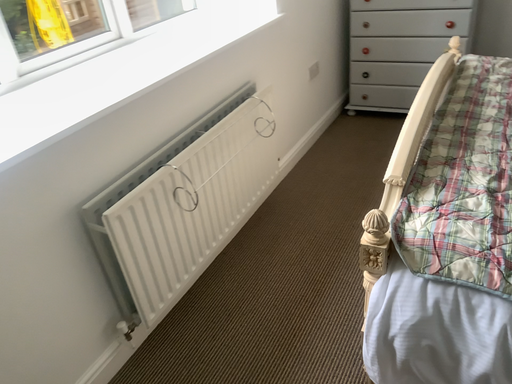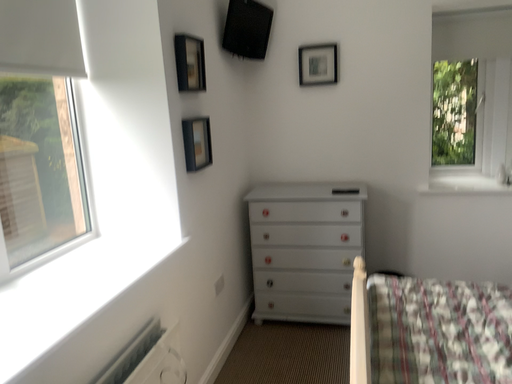
Question: How did the camera likely rotate when shooting the video?

Choices:
 (A) rotated right
 (B) rotated left

Answer: (A)